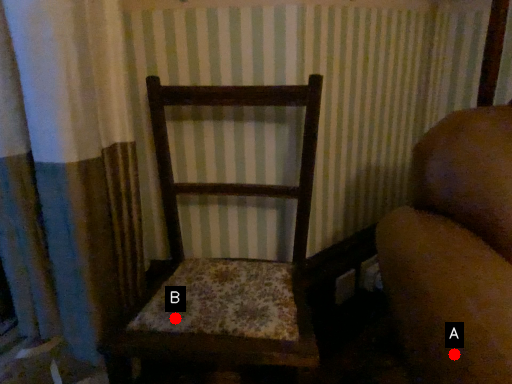
Question: Two points are circled on the image, labeled by A and B beside each circle. Which point is farther from the camera taking this photo?

Choices:
 (A) A is further
 (B) B is further

Answer: (B)